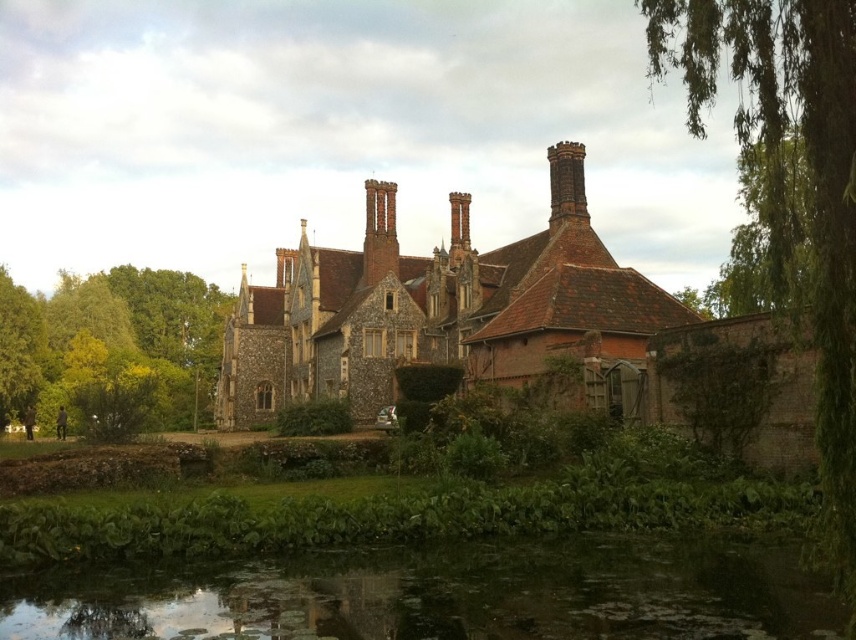
Question: Which point appears closest to the camera in this image?

Choices:
 (A) (370, 236)
 (B) (98, 300)
 (C) (583, 208)
 (D) (829, 252)

Answer: (D)

Question: Does green leafy tree at right appear over green leafy tree at lower left?

Choices:
 (A) no
 (B) yes

Answer: (B)

Question: Does green leafy tree at right have a larger size compared to smooth brick chimney at center?

Choices:
 (A) no
 (B) yes

Answer: (B)

Question: Which of the following is the closest to the observer?

Choices:
 (A) green leafy tree at right
 (B) dark brown brick chimney at upper center
 (C) smooth brick chimney at center

Answer: (A)

Question: Which object is closer to the camera taking this photo?

Choices:
 (A) green leafy tree at lower left
 (B) green leafy tree at right
 (C) green mossy water at lower center

Answer: (B)

Question: Does green leafy tree at lower left come in front of smooth brick chimney at center?

Choices:
 (A) no
 (B) yes

Answer: (B)